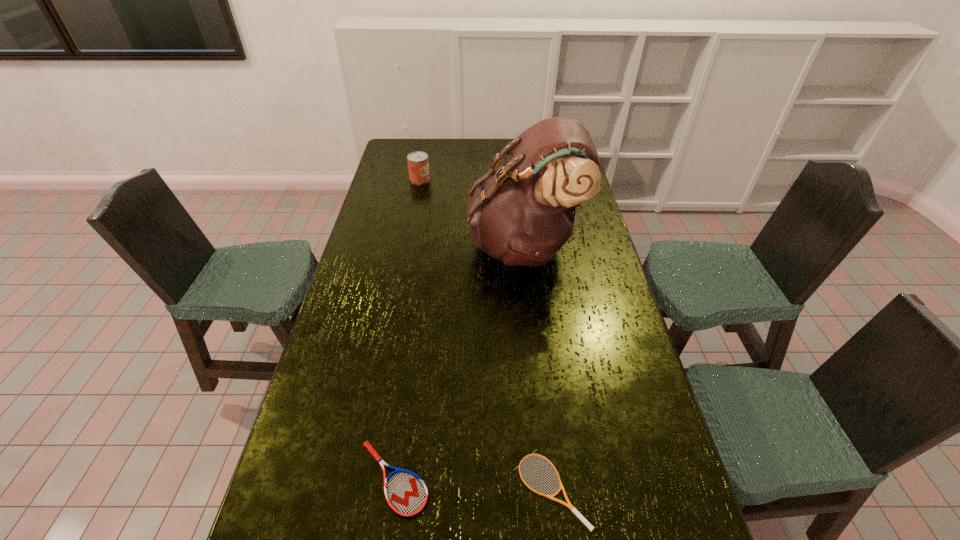
Find the location of a particular element. The image size is (960, 540). free spot located on the front of the third shortest object is located at coordinates (414, 210).

Where is `vacant area located 0.250m on the right of the left tennis racket`? This screenshot has width=960, height=540. vacant area located 0.250m on the right of the left tennis racket is located at coordinates (537, 478).

Where is `vacant space situated 0.210m on the right of the right tennis racket`? The height and width of the screenshot is (540, 960). vacant space situated 0.210m on the right of the right tennis racket is located at coordinates (678, 489).

You are a GUI agent. You are given a task and a screenshot of the screen. Output one action in this format:
    pyautogui.click(x=<x>, y=<y>)
    Task: Click on the object positioned at the left edge
    The image size is (960, 540).
    Given the screenshot: What is the action you would take?
    pyautogui.click(x=418, y=165)

The image size is (960, 540). I want to click on object located at the right edge, so click(522, 213).

Find the location of `free space at the far edge`. free space at the far edge is located at coordinates (465, 143).

Identify the location of free region at the left edge. The width and height of the screenshot is (960, 540). (354, 436).

In the image, there is a desktop. Where is `vacant space at the right edge`? This screenshot has height=540, width=960. vacant space at the right edge is located at coordinates (573, 286).

In the image, there is a desktop. Where is `free region at the far left corner`? free region at the far left corner is located at coordinates (396, 160).

Find the location of a particular element. This screenshot has width=960, height=540. free area in between the shorter tennis racket and the satchel is located at coordinates (538, 367).